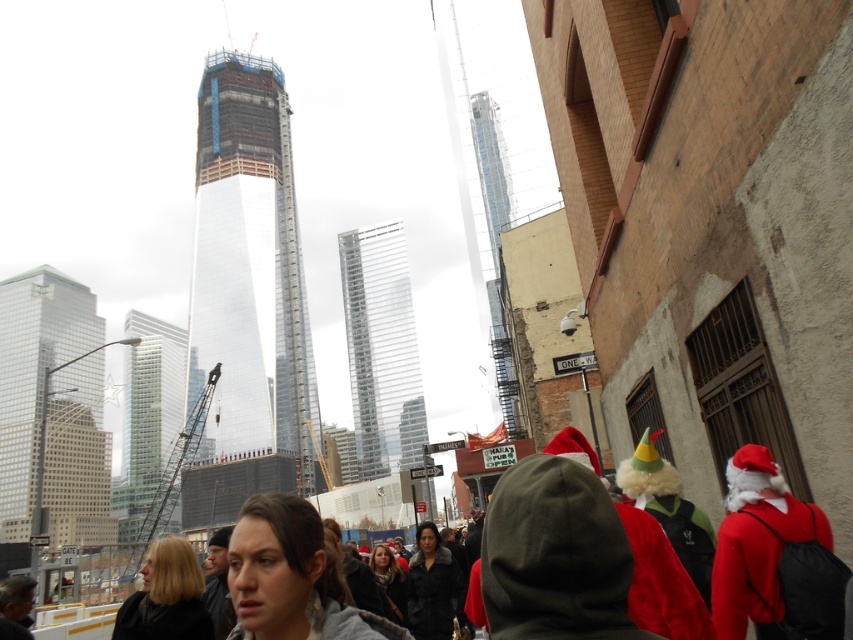
From the picture: Which is more to the left, red velvet santa hat at center-right or velvet red santa hat at right?

From the viewer's perspective, velvet red santa hat at right appears more on the left side.

Is red velvet santa hat at center-right to the right of velvet red santa hat at right from the viewer's perspective?

Indeed, red velvet santa hat at center-right is positioned on the right side of velvet red santa hat at right.

Where is `red velvet santa hat at center-right`? This screenshot has height=640, width=853. red velvet santa hat at center-right is located at coordinates (757, 545).